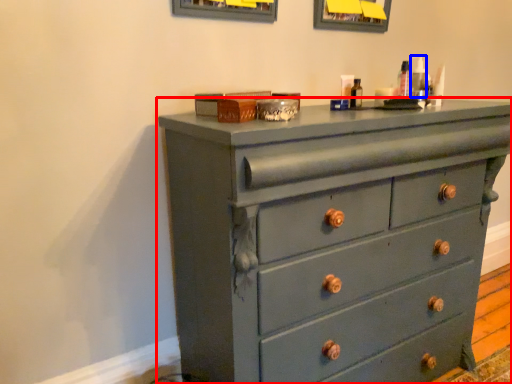
Question: Which object is further to the camera taking this photo, chest of drawers (highlighted by a red box) or toiletry (highlighted by a blue box)?

Choices:
 (A) chest of drawers
 (B) toiletry

Answer: (B)